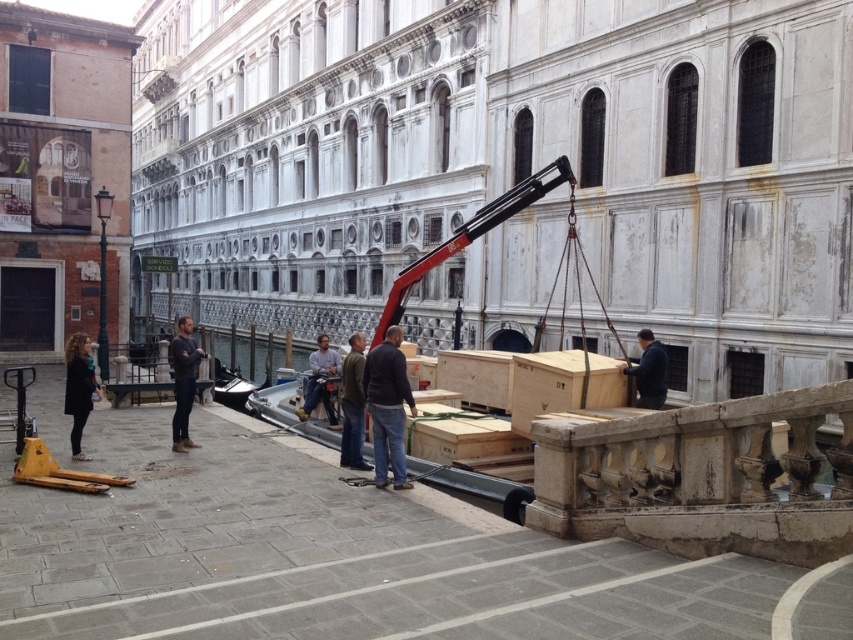
You are standing in front of the ornate classical building by the canal. You notice a point marked at coordinates (387, 406). What object is this point located on?

The point at coordinates (387, 406) is located on the dark blue sweater at center.

You are an architect examining the scene. You see a dark blue sweater at center and a dark blue fabric at center. Which object is located to the left of the other?

The dark blue sweater at center is positioned on the left side of dark blue fabric at center.

You are a delivery person who needs to place a package on a shelf that is 65 feet away. You see the dark gray sweater at center and the dark blue fabric at center. Which object is closer to the shelf?

The dark gray sweater at center is 65.21 feet from the dark blue fabric at center. Since the shelf is 65 feet away, the dark gray sweater at center is closer to the shelf than the dark blue fabric at center.